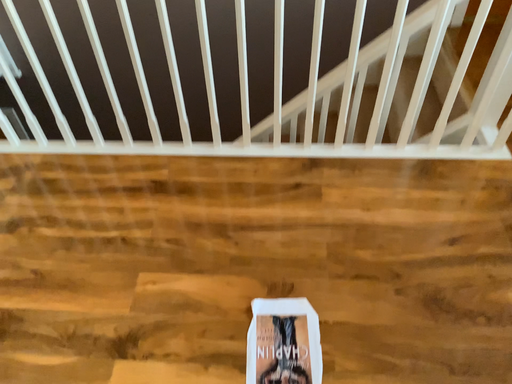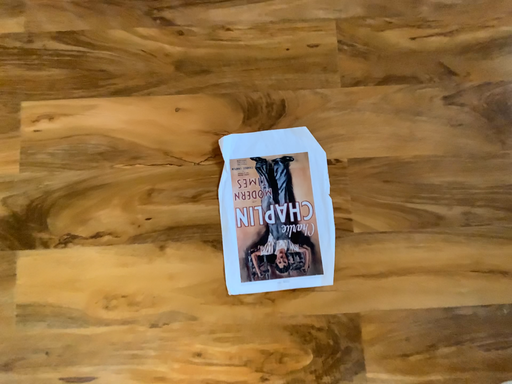
Question: Which way did the camera rotate in the video?

Choices:
 (A) rotated downward
 (B) rotated upward

Answer: (A)